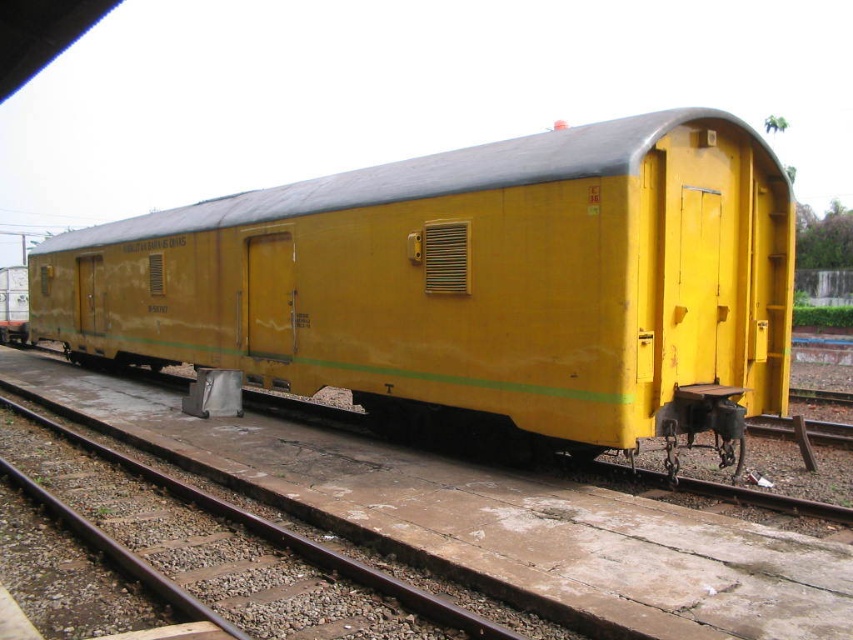
You are standing at the front of the yellow railway carriage and want to place a small sticker on either the point at coordinates point (660, 218) or point (108, 458). Which point is closer to you so the sticker will be more visible?

Point (660, 218) is closer to the viewer than point (108, 458), so placing the sticker there will make it more visible.

You are a maintenance worker checking the train car and track. You need to access the brown metal train track at lower left. Is the yellow matte train car at center blocking your path to it?

The yellow matte train car at center is above the brown metal train track at lower left, so it is blocking the path to the brown metal train track at lower left.

You are a maintenance worker standing on the platform and need to access the brown metal train track at lower left. Can you walk directly to it from your current position without going around the yellow matte train car at center?

The brown metal train track at lower left is behind the yellow matte train car at center, so you cannot walk directly to it without going around the yellow matte train car at center.